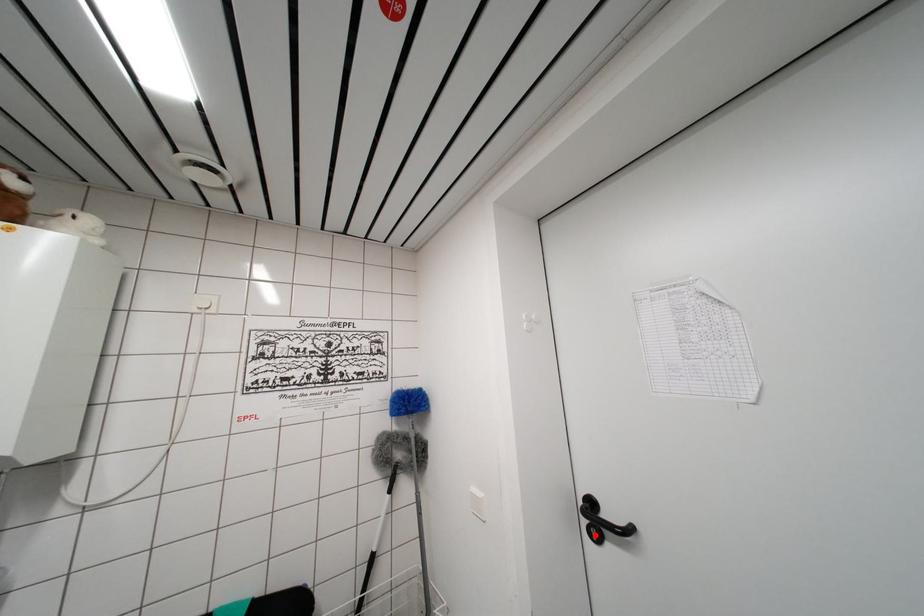
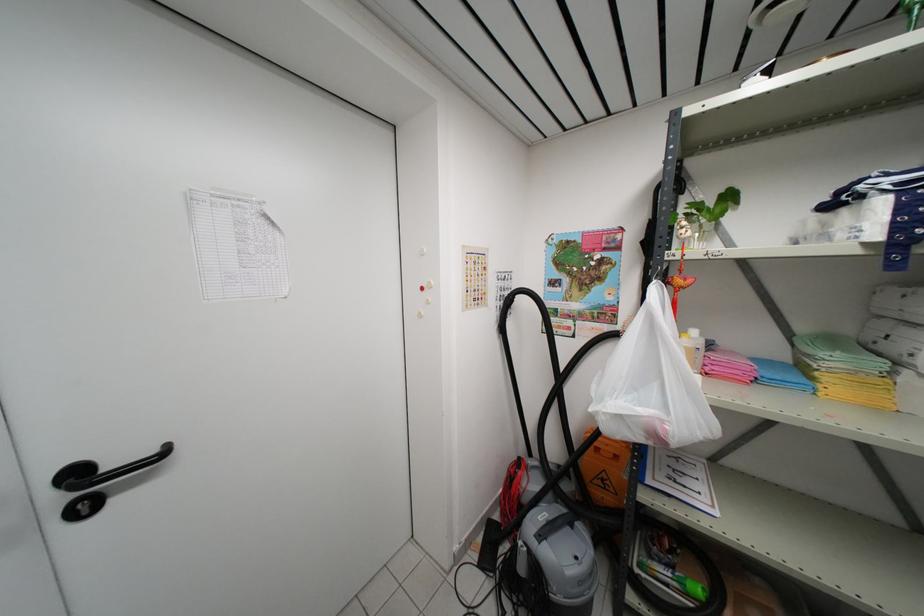
Find the pixel in the second image that matches the highlighted location in the first image.

(83, 512)